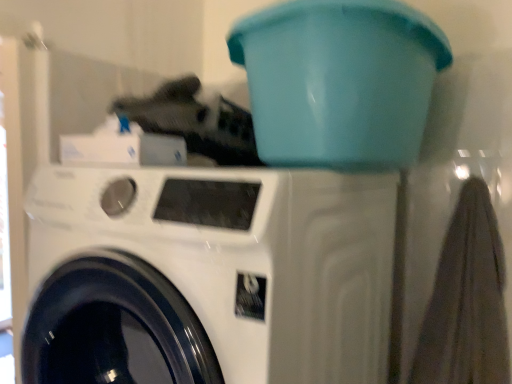
Question: From the image's perspective, is teal plastic bucket at upper center above or below white glossy washing machine at center?

Choices:
 (A) below
 (B) above

Answer: (B)

Question: Considering their positions, is teal plastic bucket at upper center located in front of or behind white glossy washing machine at center?

Choices:
 (A) behind
 (B) front

Answer: (A)

Question: Do you think teal plastic bucket at upper center is within white glossy washing machine at center, or outside of it?

Choices:
 (A) outside
 (B) inside

Answer: (A)

Question: In the image, is white glossy washing machine at center on the left side or the right side of teal plastic bucket at upper center?

Choices:
 (A) left
 (B) right

Answer: (A)

Question: Is white glossy washing machine at center taller or shorter than teal plastic bucket at upper center?

Choices:
 (A) tall
 (B) short

Answer: (A)

Question: Based on their sizes in the image, would you say white glossy washing machine at center is bigger or smaller than teal plastic bucket at upper center?

Choices:
 (A) small
 (B) big

Answer: (B)

Question: Is point (x=161, y=180) closer or farther from the camera than point (x=261, y=127)?

Choices:
 (A) closer
 (B) farther

Answer: (A)